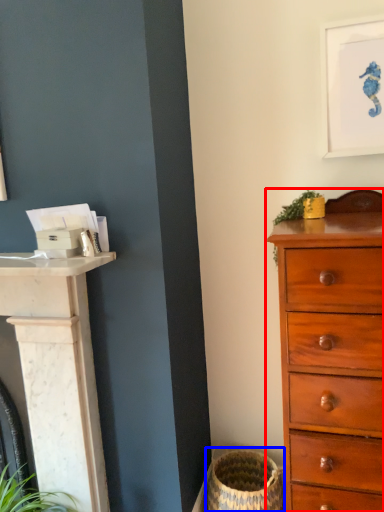
Question: Which object appears closest to the camera in this image, chest of drawers (highlighted by a red box) or basket container (highlighted by a blue box)?

Choices:
 (A) chest of drawers
 (B) basket container

Answer: (A)